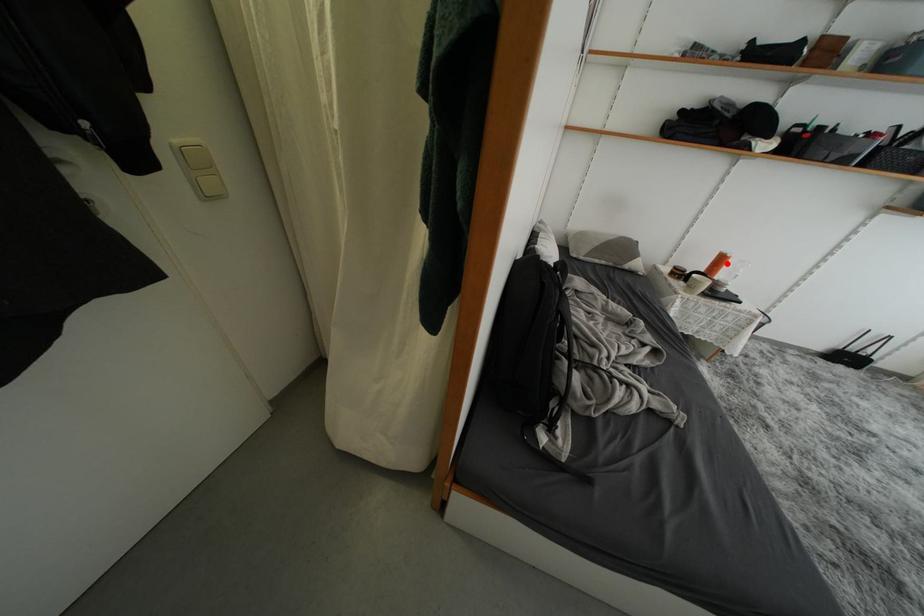
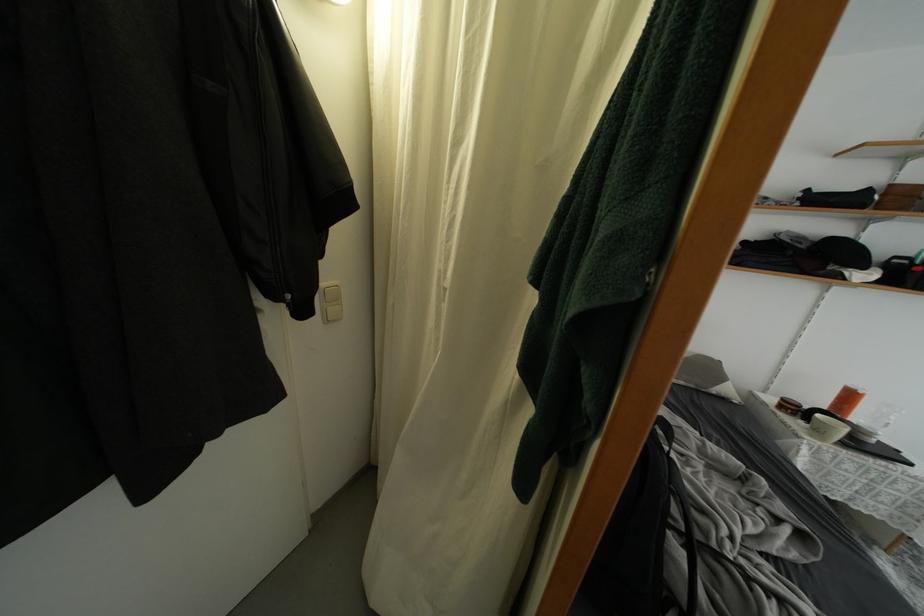
Where in the second image is the point corresponding to the highlighted location from the first image?

(856, 400)